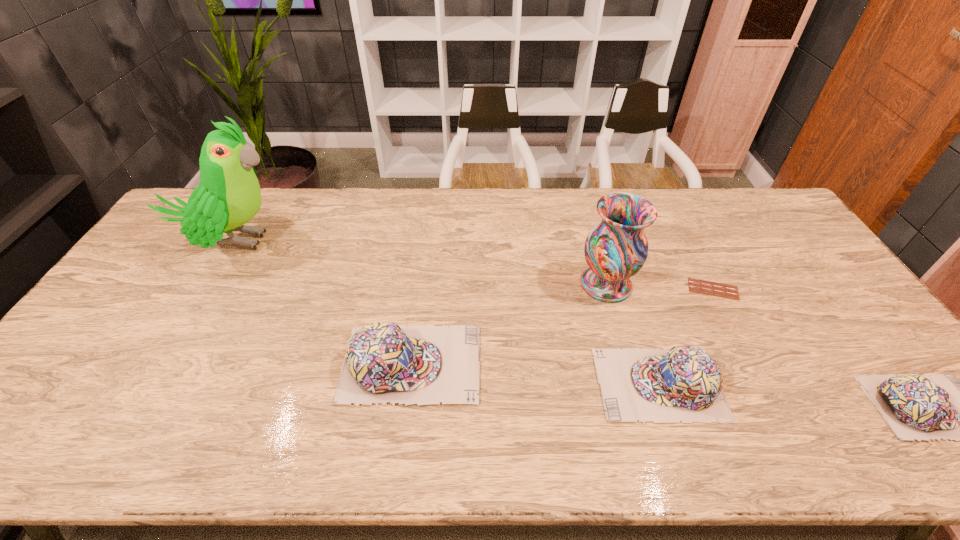
Select which cap appears as the second closest to the second cap from left to right. Please provide its 2D coordinates. Your answer should be formatted as a tuple, i.e. [(x, y)], where the tuple contains the x and y coordinates of a point satisfying the conditions above.

[(923, 407)]

Identify the location of cap that stands as the second closest to the second cap from left to right. (923, 407).

The image size is (960, 540). I want to click on vacant space that satisfies the following two spatial constraints: 1. on the front side of the shortest object; 2. on the front, side, and top of the leftmost cap, so click(752, 363).

You are a GUI agent. You are given a task and a screenshot of the screen. Output one action in this format:
    pyautogui.click(x=<x>, y=<y>)
    Task: Click on the vacant space that satisfies the following two spatial constraints: 1. on the front side of the vase; 2. on the front, side, and top of the second object from left to right
    The width and height of the screenshot is (960, 540).
    Given the screenshot: What is the action you would take?
    pyautogui.click(x=628, y=363)